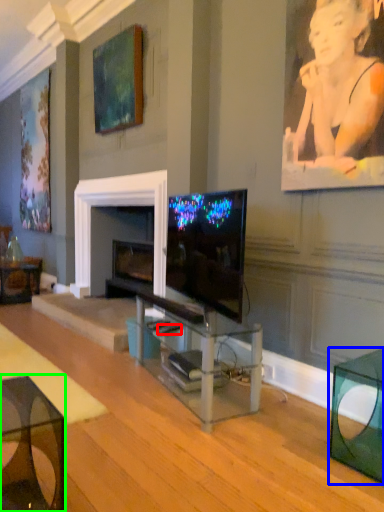
Question: Which object is positioned farthest from remote control (highlighted by a red box)? Select from table (highlighted by a blue box) and table (highlighted by a green box).

Choices:
 (A) table
 (B) table

Answer: (B)